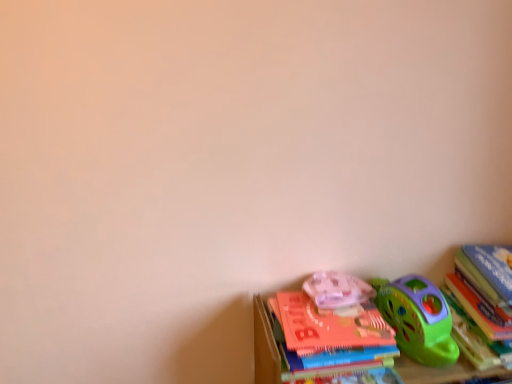
You are a GUI agent. You are given a task and a screenshot of the screen. Output one action in this format:
    pyautogui.click(x=<x>, y=<y>)
    Task: Click on the blank space to the left of translucent plastic toy at lower right
    This screenshot has height=384, width=512.
    Given the screenshot: What is the action you would take?
    pyautogui.click(x=283, y=307)